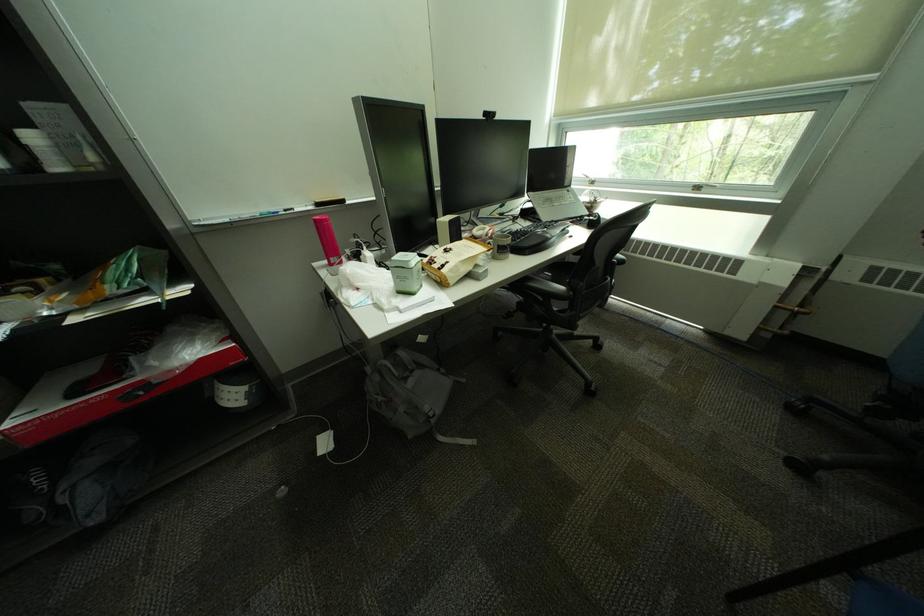
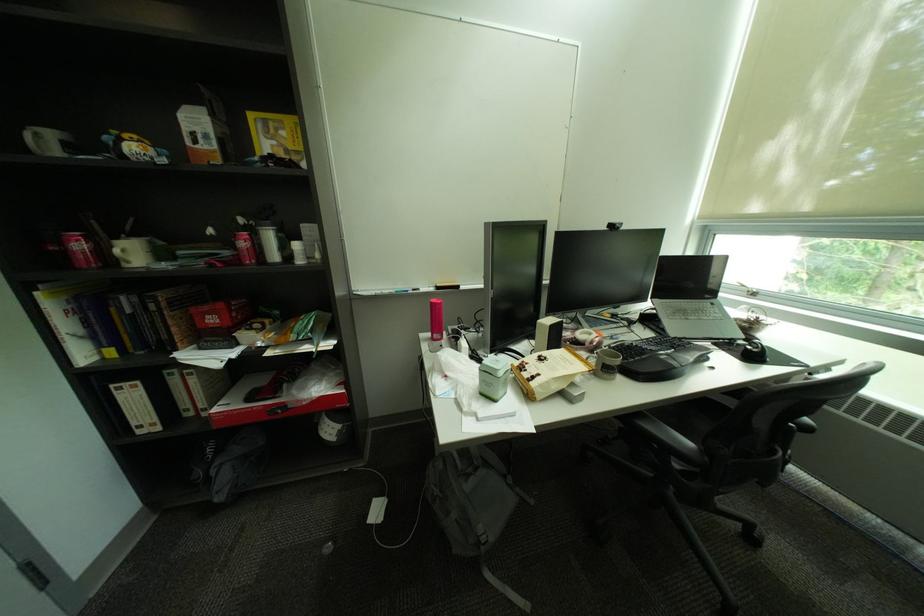
Locate, in the second image, the point that corresponds to (x=329, y=201) in the first image.

(450, 286)